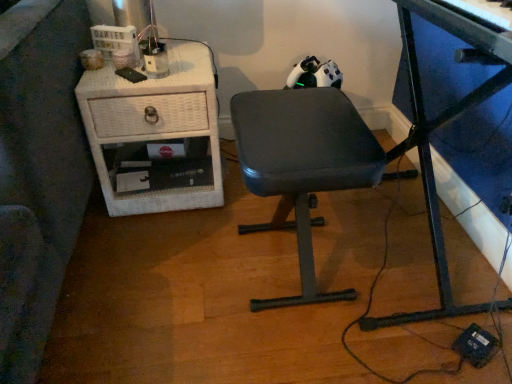
Question: From a real-world perspective, is metallic blue desk at center above or below dark gray fabric chair at center?

Choices:
 (A) below
 (B) above

Answer: (B)

Question: Is metallic blue desk at center in front of or behind dark gray fabric chair at center in the image?

Choices:
 (A) behind
 (B) front

Answer: (B)

Question: Based on their relative distances, which object is nearer to the dark gray fabric chair at center?

Choices:
 (A) metallic blue desk at center
 (B) white wicker nightstand at left

Answer: (A)

Question: Estimate the real-world distances between objects in this image. Which object is farther from the dark gray fabric chair at center?

Choices:
 (A) metallic blue desk at center
 (B) white wicker nightstand at left

Answer: (B)